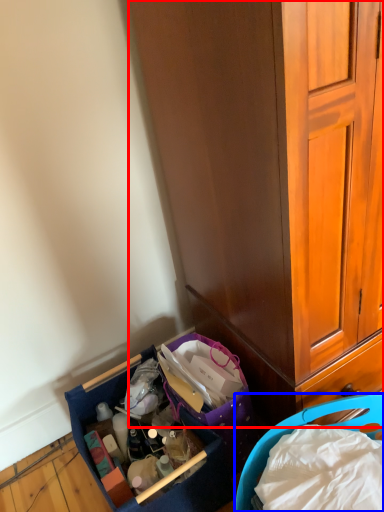
Question: Which object appears closest to the camera in this image, cabinetry (highlighted by a red box) or picnic basket (highlighted by a blue box)?

Choices:
 (A) cabinetry
 (B) picnic basket

Answer: (A)